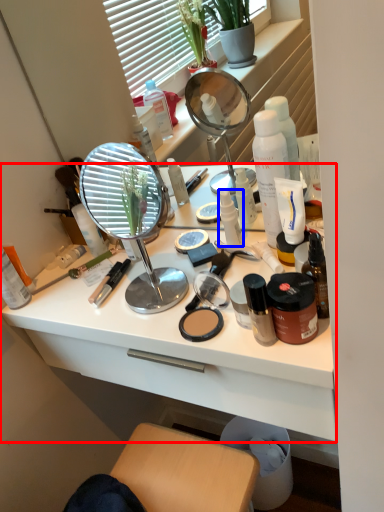
Question: Which point is further to the camera, desk (highlighted by a red box) or toiletry (highlighted by a blue box)?

Choices:
 (A) desk
 (B) toiletry

Answer: (B)